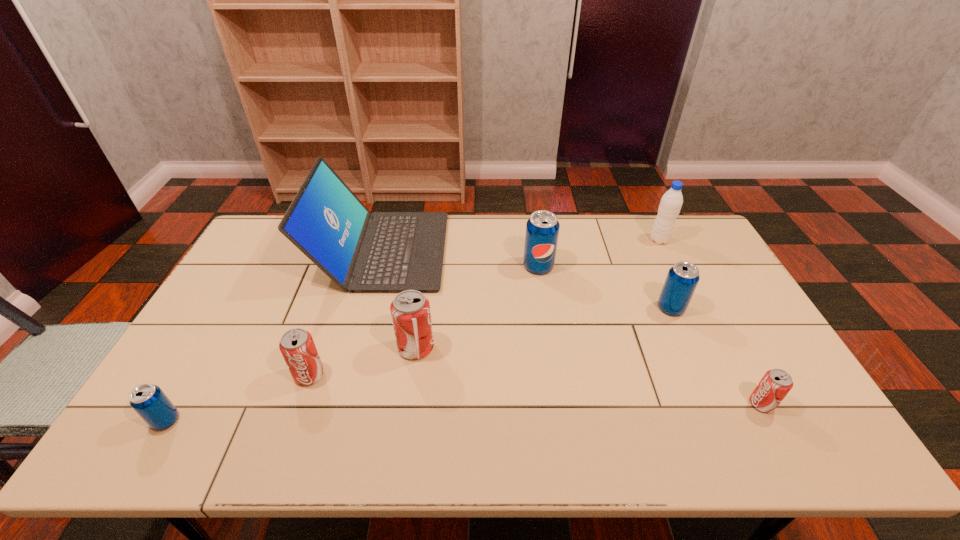
You are a GUI agent. You are given a task and a screenshot of the screen. Output one action in this format:
    pyautogui.click(x=<x>, y=<y>)
    Task: Click on the blank space at the far edge of the desktop
    The width and height of the screenshot is (960, 540).
    Given the screenshot: What is the action you would take?
    pyautogui.click(x=463, y=249)

Identify the location of blank area at the near edge. (582, 449).

You are a GUI agent. You are given a task and a screenshot of the screen. Output one action in this format:
    pyautogui.click(x=<x>, y=<y>)
    Task: Click on the vacant region at the left edge
    This screenshot has height=540, width=960.
    Given the screenshot: What is the action you would take?
    pyautogui.click(x=244, y=255)

Where is `free location at the right edge`? This screenshot has width=960, height=540. free location at the right edge is located at coordinates (705, 309).

The image size is (960, 540). What are the coordinates of `free location at the near right corner of the desktop` in the screenshot? It's located at (771, 436).

Image resolution: width=960 pixels, height=540 pixels. What are the coordinates of `free spot between the third nearest soda can and the gray water bottle` in the screenshot? It's located at (484, 307).

At what (x,y) coordinates should I click in order to perform the action: click on blank region between the water bottle and the farthest pink soda can. Please return your answer as a coordinate pair (x, y). This screenshot has width=960, height=540. Looking at the image, I should click on (538, 294).

You are a GUI agent. You are given a task and a screenshot of the screen. Output one action in this format:
    pyautogui.click(x=<x>, y=<y>)
    Task: Click on the empty location between the farthest soda can and the laptop computer
    This screenshot has height=540, width=960.
    Given the screenshot: What is the action you would take?
    pyautogui.click(x=460, y=258)

You are a GUI agent. You are given a task and a screenshot of the screen. Output one action in this format:
    pyautogui.click(x=<x>, y=<y>)
    Task: Click on the free point between the biggest pink soda can and the leftmost object
    The image size is (960, 540).
    Given the screenshot: What is the action you would take?
    pyautogui.click(x=291, y=384)

You are a GUI agent. You are given a task and a screenshot of the screen. Output one action in this format:
    pyautogui.click(x=<x>, y=<y>)
    Task: Click on the blank region between the fifth farthest object and the second farthest blue pop soda
    This screenshot has width=960, height=540.
    Given the screenshot: What is the action you would take?
    pyautogui.click(x=543, y=328)